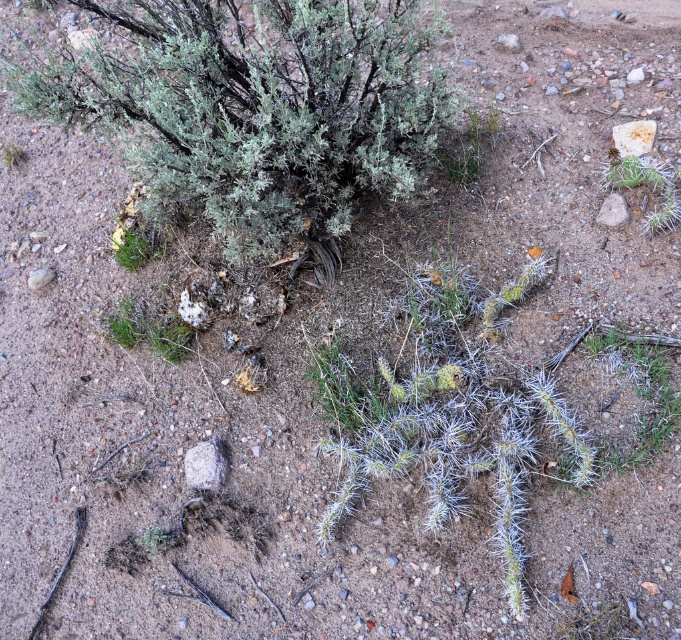
You are a desert explorer and you see the green spiny cactus at lower right and the green fuzzy bush at upper left. Which object is closer to you?

The green spiny cactus at lower right is closer to you because it is in front of the green fuzzy bush at upper left.

You are standing in the desert scene and want to place a small flag at the point that is closer to you. Which point should you choose between point (114,307) and point (118,225)?

You should choose point (114,307) because it is closer to the viewer than point (118,225) according to the description.